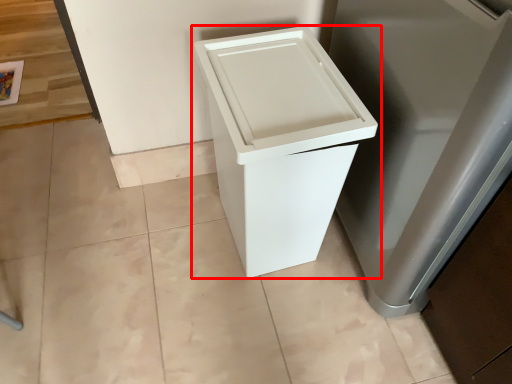
Question: From the image's perspective, considering the relative positions of waste container (annotated by the red box) and appliance in the image provided, where is waste container (annotated by the red box) located with respect to the staircase?

Choices:
 (A) above
 (B) below

Answer: (B)